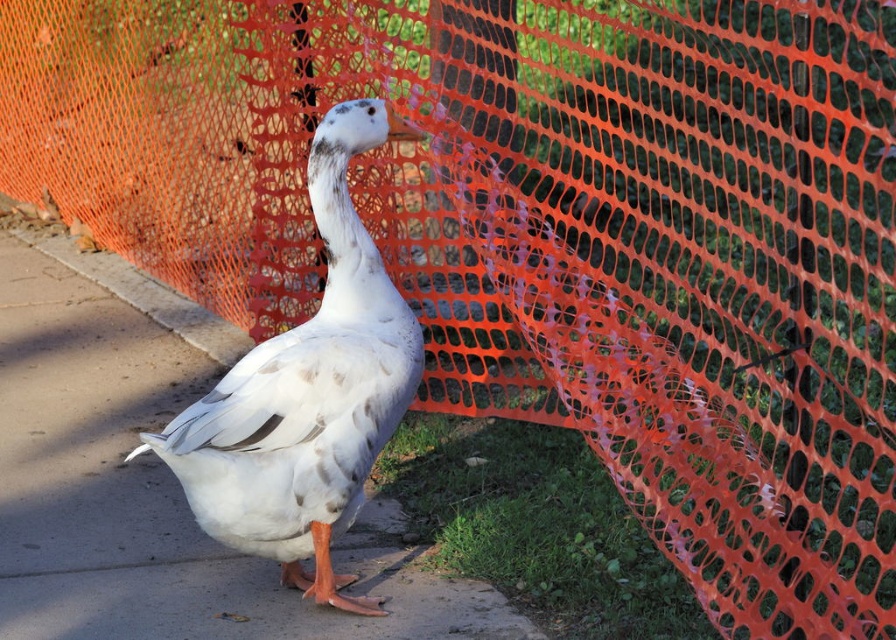
Does point (220, 561) lie behind point (118, 259)?

No.

Is white matte pavement at center wider than concrete at lower left?

Indeed, white matte pavement at center has a greater width compared to concrete at lower left.

This screenshot has height=640, width=896. I want to click on white matte pavement at center, so click(158, 484).

In the scene shown: Is white matte pavement at center thinner than white matte duck at center?

In fact, white matte pavement at center might be wider than white matte duck at center.

Which is behind, point (128, 344) or point (313, 592)?

The point (128, 344) is more distant.

Where is `white matte pavement at center`? This screenshot has height=640, width=896. white matte pavement at center is located at coordinates (158, 484).

Who is more forward, [330,164] or [59,259]?

Point [330,164]

The width and height of the screenshot is (896, 640). In order to click on white matte duck at center in this screenshot , I will do `click(307, 392)`.

Is point (266, 360) closer to viewer compared to point (214, 348)?

Yes, it is in front of point (214, 348).

Locate an element on the screen. white matte duck at center is located at coordinates (307, 392).